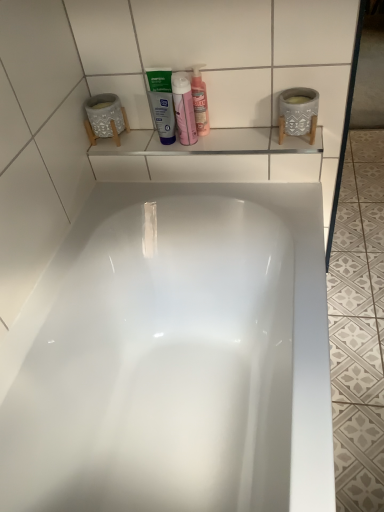
Question: Is white glossy bathtub at center behind translucent plastic bottle at upper center?

Choices:
 (A) no
 (B) yes

Answer: (A)

Question: Would you consider white glossy bathtub at center to be distant from translucent plastic bottle at upper center?

Choices:
 (A) no
 (B) yes

Answer: (A)

Question: Is white glossy bathtub at center at the left side of translucent plastic bottle at upper center?

Choices:
 (A) no
 (B) yes

Answer: (A)

Question: Is white glossy bathtub at center directly adjacent to translucent plastic bottle at upper center?

Choices:
 (A) no
 (B) yes

Answer: (A)

Question: Considering the relative positions of white glossy bathtub at center and translucent plastic bottle at upper center in the image provided, is white glossy bathtub at center in front of translucent plastic bottle at upper center?

Choices:
 (A) yes
 (B) no

Answer: (A)

Question: Looking at the image, does white matte tube at center seem bigger or smaller compared to translucent plastic bottle at upper center?

Choices:
 (A) small
 (B) big

Answer: (A)

Question: Looking at their shapes, would you say white matte tube at center is wider or thinner than translucent plastic bottle at upper center?

Choices:
 (A) thin
 (B) wide

Answer: (A)

Question: In terms of height, does white matte tube at center look taller or shorter compared to translucent plastic bottle at upper center?

Choices:
 (A) tall
 (B) short

Answer: (B)

Question: Visually, is white matte tube at center positioned to the left or to the right of translucent plastic bottle at upper center?

Choices:
 (A) left
 (B) right

Answer: (A)

Question: Considering the positions of white glossy bathtub at center and translucent plastic bottle at upper center in the image, is white glossy bathtub at center taller or shorter than translucent plastic bottle at upper center?

Choices:
 (A) tall
 (B) short

Answer: (A)

Question: Does point (79, 331) appear closer or farther from the camera than point (183, 141)?

Choices:
 (A) closer
 (B) farther

Answer: (A)

Question: Looking at the image, does white glossy bathtub at center seem bigger or smaller compared to translucent plastic bottle at upper center?

Choices:
 (A) small
 (B) big

Answer: (B)

Question: From a real-world perspective, is white glossy bathtub at center positioned above or below translucent plastic bottle at upper center?

Choices:
 (A) below
 (B) above

Answer: (A)

Question: Relative to white glossy bathtub at center, is translucent plastic bottle at upper center in front or behind?

Choices:
 (A) behind
 (B) front

Answer: (A)

Question: In the image, is translucent plastic bottle at upper center on the left side or the right side of white glossy bathtub at center?

Choices:
 (A) right
 (B) left

Answer: (B)